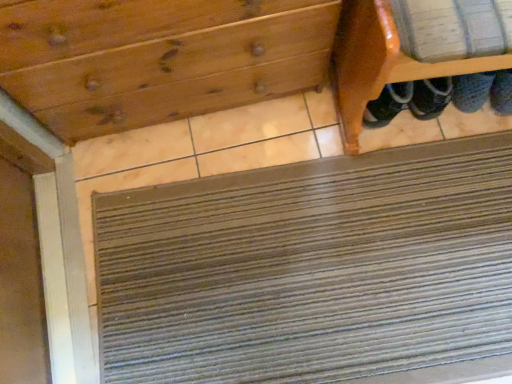
Question: Can you confirm if wooden shoe rack at upper right is wider than wooden drawer at upper center?

Choices:
 (A) yes
 (B) no

Answer: (A)

Question: From a real-world perspective, does wooden shoe rack at upper right stand above wooden drawer at upper center?

Choices:
 (A) yes
 (B) no

Answer: (A)

Question: Considering the relative positions of wooden shoe rack at upper right and wooden drawer at upper center in the image provided, is wooden shoe rack at upper right behind wooden drawer at upper center?

Choices:
 (A) yes
 (B) no

Answer: (B)

Question: Does wooden shoe rack at upper right have a lesser height compared to wooden drawer at upper center?

Choices:
 (A) no
 (B) yes

Answer: (B)

Question: Is wooden shoe rack at upper right not close to wooden drawer at upper center?

Choices:
 (A) no
 (B) yes

Answer: (A)

Question: Does wooden shoe rack at upper right have a lesser width compared to wooden drawer at upper center?

Choices:
 (A) no
 (B) yes

Answer: (A)

Question: Considering the relative sizes of wooden drawer at upper center and wooden shoe rack at upper right in the image provided, is wooden drawer at upper center smaller than wooden shoe rack at upper right?

Choices:
 (A) no
 (B) yes

Answer: (A)

Question: Can we say wooden drawer at upper center lies outside wooden shoe rack at upper right?

Choices:
 (A) no
 (B) yes

Answer: (B)

Question: Can you confirm if wooden drawer at upper center is taller than wooden shoe rack at upper right?

Choices:
 (A) no
 (B) yes

Answer: (B)

Question: From a real-world perspective, is wooden drawer at upper center below wooden shoe rack at upper right?

Choices:
 (A) no
 (B) yes

Answer: (B)

Question: Is wooden drawer at upper center looking in the opposite direction of wooden shoe rack at upper right?

Choices:
 (A) yes
 (B) no

Answer: (B)

Question: Is wooden drawer at upper center at the right side of wooden shoe rack at upper right?

Choices:
 (A) yes
 (B) no

Answer: (B)

Question: Is wooden drawer at upper center taller than brown textured mat at lower center?

Choices:
 (A) no
 (B) yes

Answer: (B)